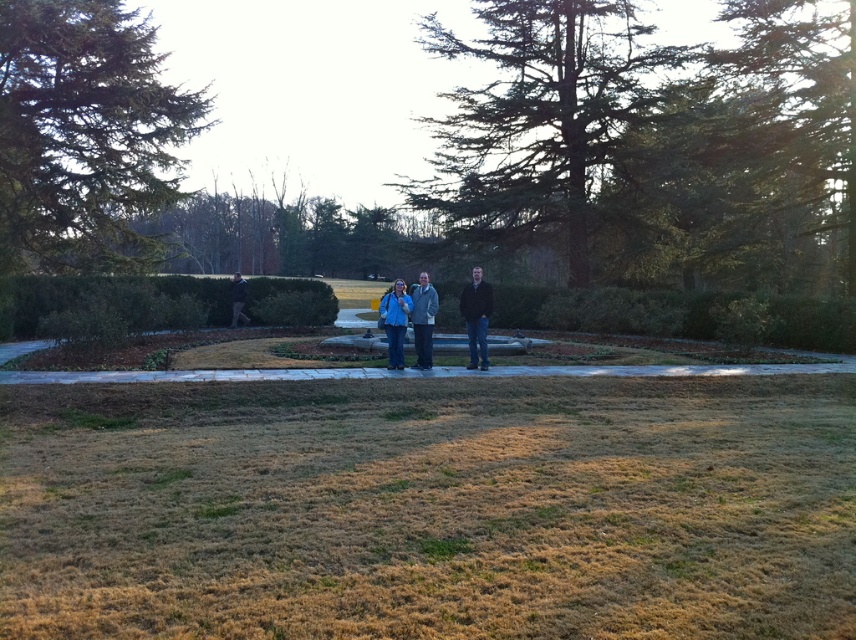
Question: Which point is closer to the camera taking this photo?

Choices:
 (A) [391, 360]
 (B) [158, 179]
 (C) [518, 170]
 (D) [476, 353]

Answer: (A)

Question: Among these points, which one is nearest to the camera?

Choices:
 (A) (414, 291)
 (B) (480, 323)
 (C) (434, 458)
 (D) (141, 321)

Answer: (C)

Question: Is green leafy hedge at center further to camera compared to dark brown leather jacket at center?

Choices:
 (A) yes
 (B) no

Answer: (A)

Question: Does brown grass at center lie behind dark brown leather jacket at center?

Choices:
 (A) no
 (B) yes

Answer: (A)

Question: Which point is farther from the camera taking this photo?

Choices:
 (A) (128, 589)
 (B) (566, 16)
 (C) (486, 364)
 (D) (30, 1)

Answer: (B)

Question: Can you confirm if brown grass at center is positioned below dark brown leather jacket at center?

Choices:
 (A) yes
 (B) no

Answer: (A)